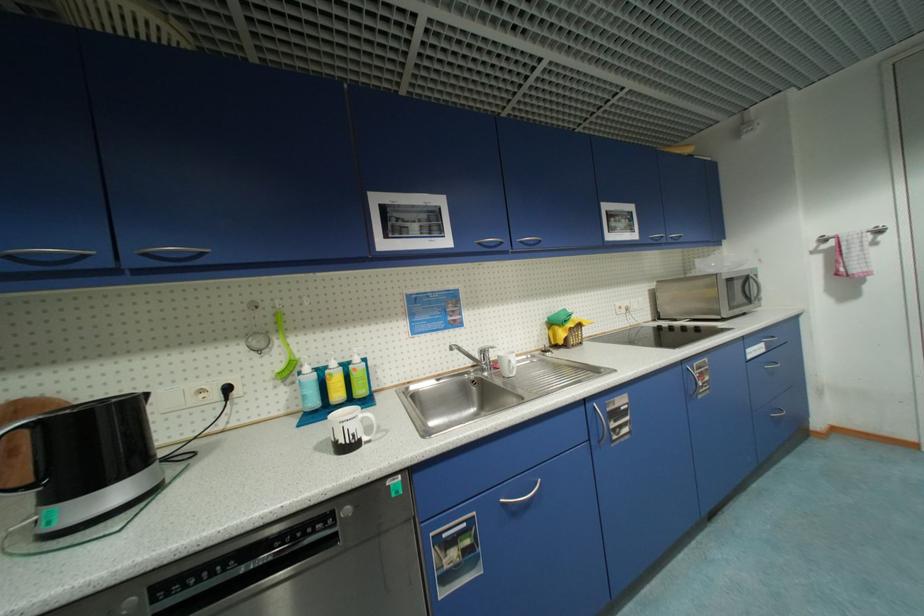
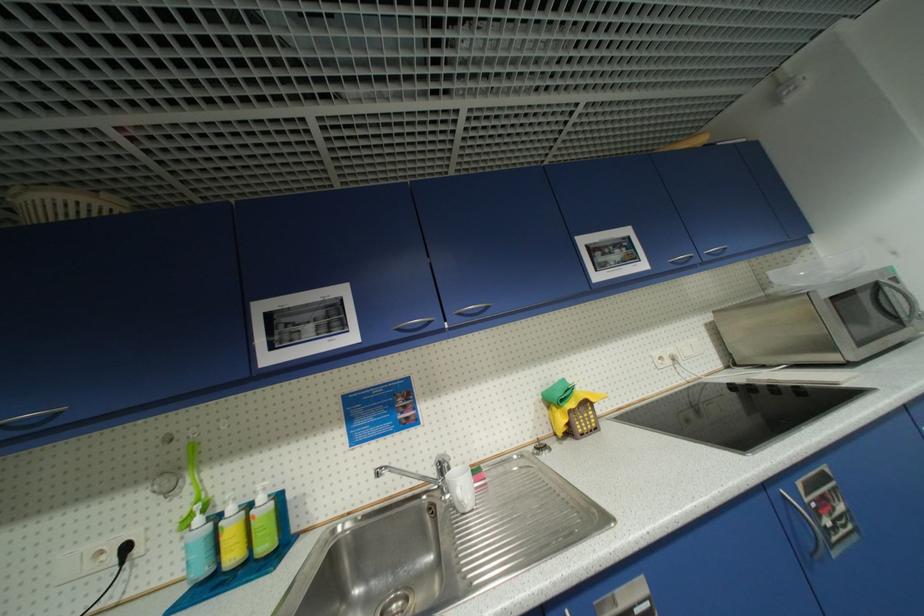
Question: The images are taken continuously from a first-person perspective. In which direction is your viewpoint rotating?

Choices:
 (A) Left
 (B) Right
 (C) Up
 (D) Down

Answer: (A)